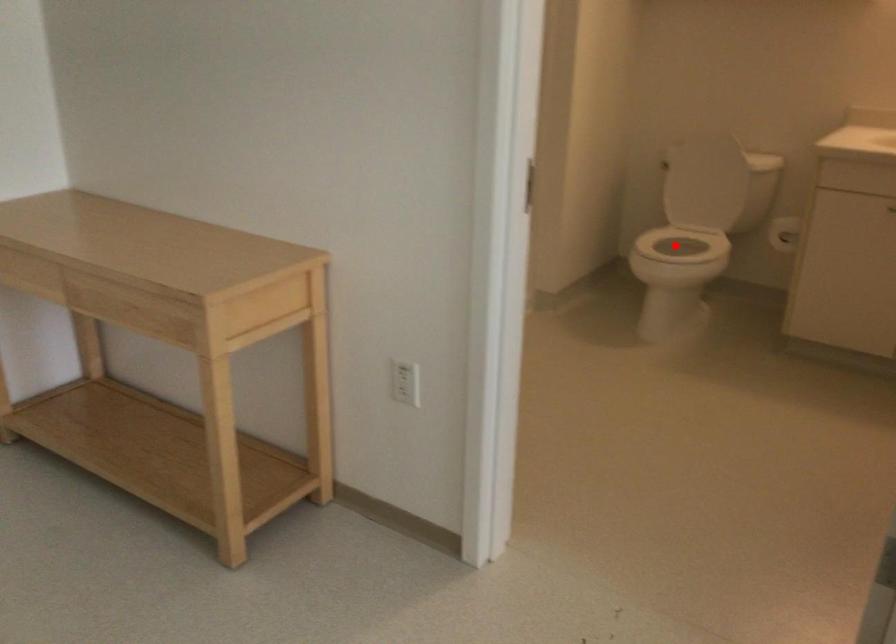
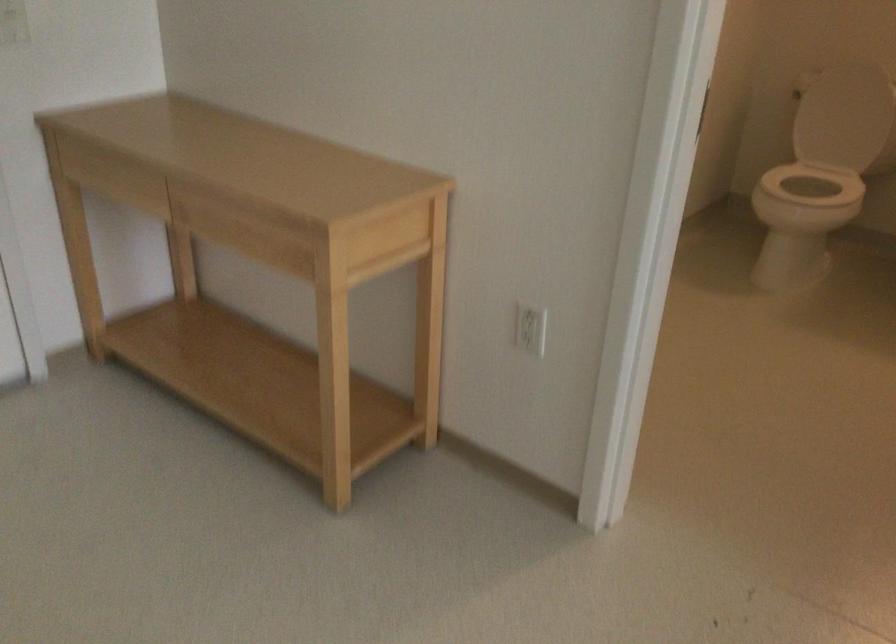
Question: I am providing you with two images of the same scene from different viewpoints. Given a red point in image1, look at the same physical point in image2. Is it:

Choices:
 (A) Closer to the viewpoint
 (B) Farther from the viewpoint

Answer: (A)